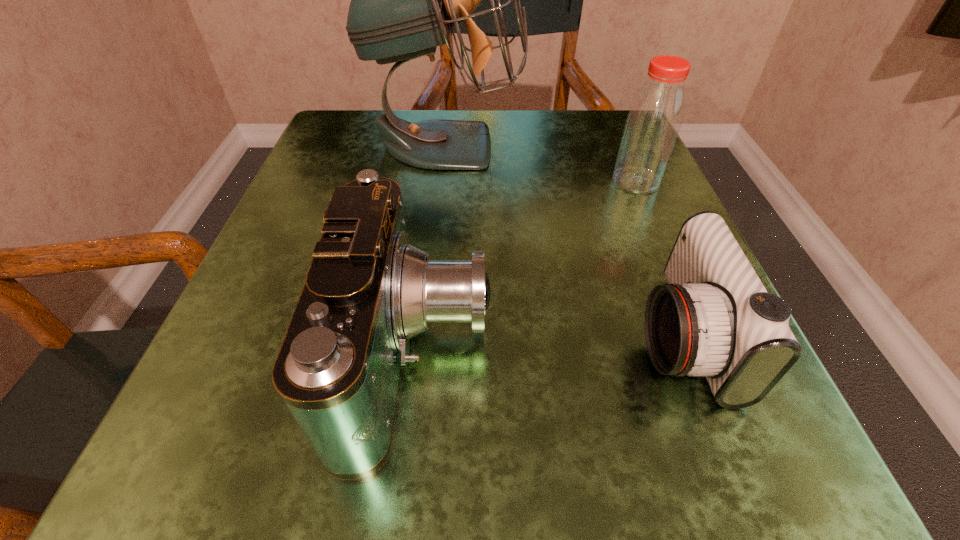
Find the location of a particular element. The image size is (960, 540). vacant area situated 0.090m on the surface of the right camcorder is located at coordinates (567, 336).

I want to click on blank space located 0.370m on the surface of the right camcorder, so click(x=347, y=336).

Image resolution: width=960 pixels, height=540 pixels. Find the location of `fan positioned at the far edge`. fan positioned at the far edge is located at coordinates (404, 0).

You are a GUI agent. You are given a task and a screenshot of the screen. Output one action in this format:
    pyautogui.click(x=<x>, y=<y>)
    Task: Click on the bottle present at the far edge
    
    Given the screenshot: What is the action you would take?
    point(655,116)

In order to click on object that is at the near edge in this screenshot , I will do `click(368, 291)`.

At what (x,y) coordinates should I click in order to perform the action: click on fan positioned at the left edge. Please return your answer as a coordinate pair (x, y). Looking at the image, I should click on (404, 0).

At what (x,y) coordinates should I click in order to perform the action: click on camcorder that is at the left edge. Please return your answer as a coordinate pair (x, y). Looking at the image, I should click on (368, 291).

Find the location of `bottle at the right edge`. bottle at the right edge is located at coordinates (655, 116).

You are a GUI agent. You are given a task and a screenshot of the screen. Output one action in this format:
    pyautogui.click(x=<x>, y=<y>)
    Task: Click on the camcorder that is positioned at the right edge
    This screenshot has height=540, width=960.
    Given the screenshot: What is the action you would take?
    715,318

Locate an element on the screen. The height and width of the screenshot is (540, 960). object that is at the far left corner is located at coordinates (404, 0).